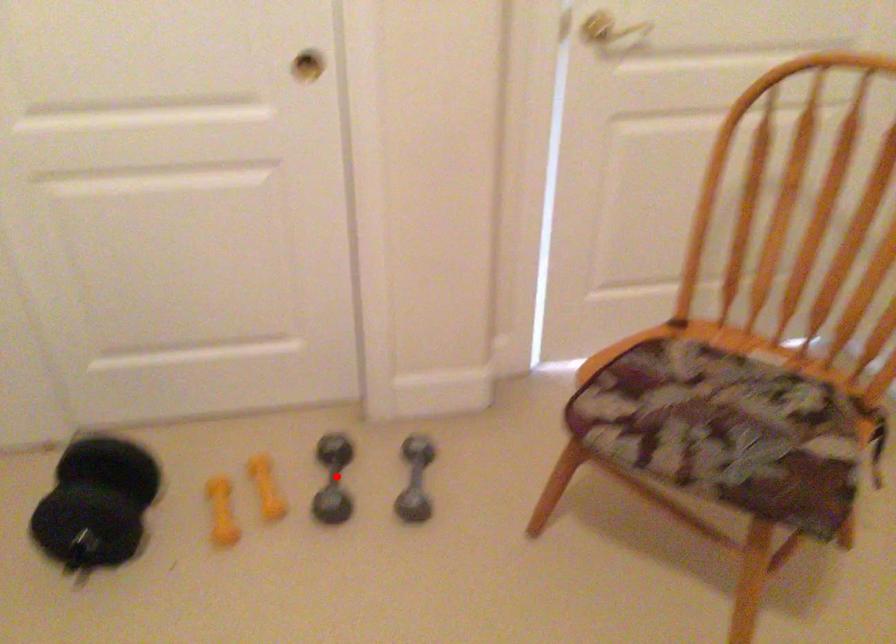
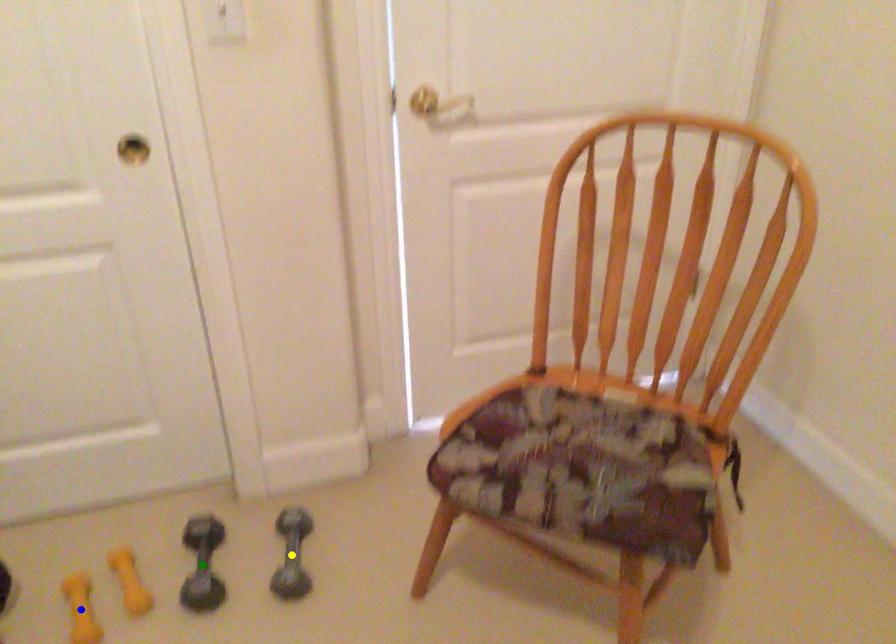
Question: I am providing you with two images of the same scene from different viewpoints. A red point is marked on the first image. You are given multiple points on the second image. Which mark in image 2 goes with the point in image 1?

Choices:
 (A) yellow point
 (B) green point
 (C) blue point

Answer: (B)